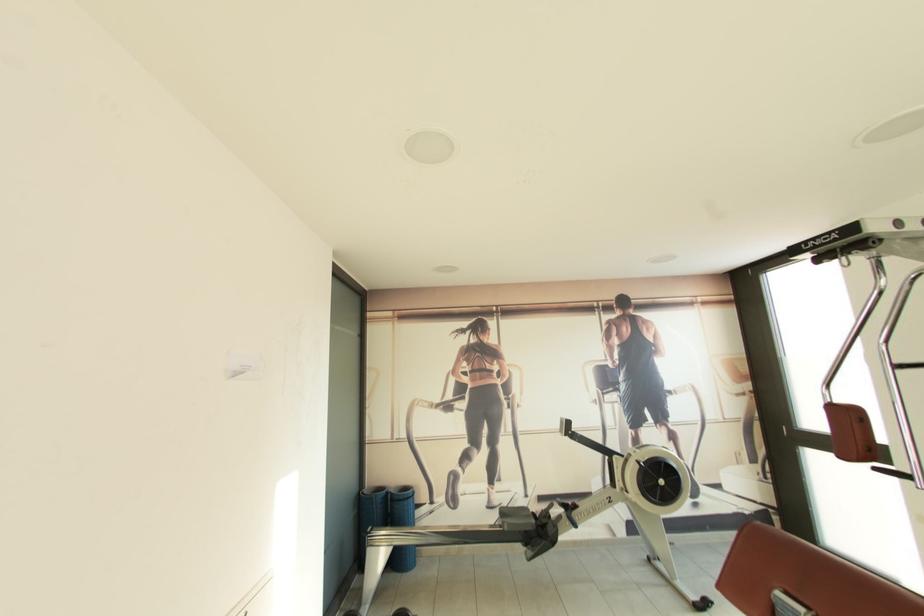
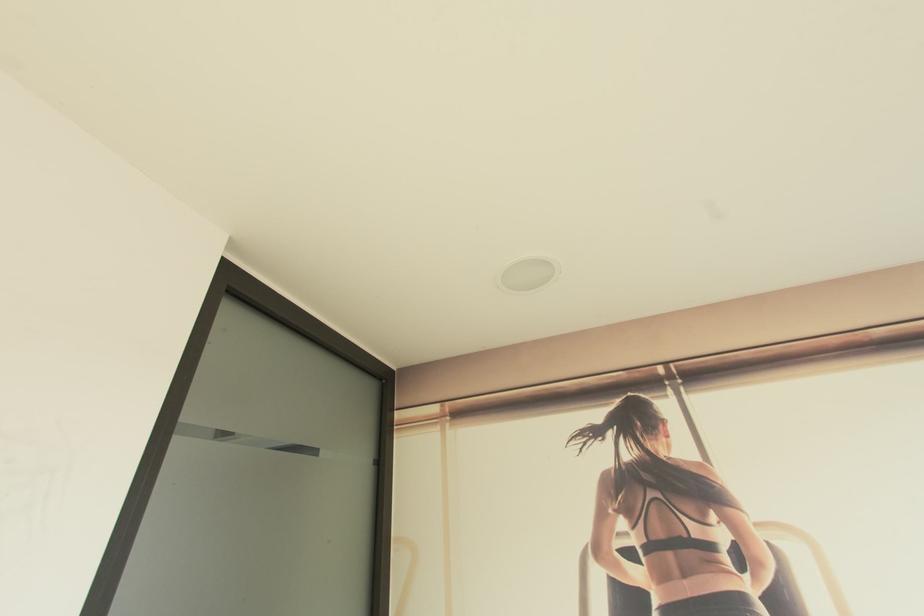
Question: In a continuous first-person perspective shot, in which direction is the camera moving?

Choices:
 (A) Left
 (B) Right
 (C) Forward
 (D) Backward

Answer: (C)